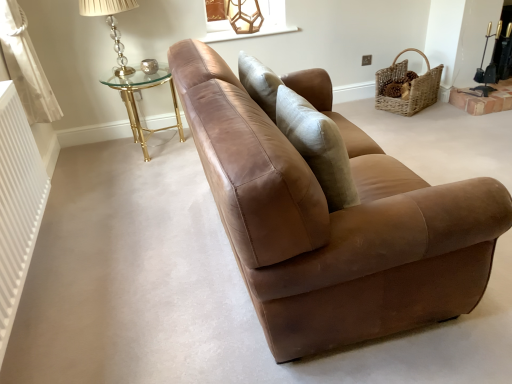
What do you see at coordinates (17, 204) in the screenshot? I see `white ribbed radiator at left` at bounding box center [17, 204].

Identify the location of brown leather couch at center. (333, 220).

What is the approximate height of white fabric curtain at left?

white fabric curtain at left is 30.56 inches in height.

The image size is (512, 384). Find the location of `white ribbed radiator at left`. white ribbed radiator at left is located at coordinates (17, 204).

Would you say white ribbed radiator at left is inside or outside metallic glass table lamp at upper center, which is the first table lamp in right-to-left order?

white ribbed radiator at left is outside metallic glass table lamp at upper center, which is the first table lamp in right-to-left order.

Where is `radiator lying in front of the metallic glass table lamp at upper center, the second table lamp positioned from the front`? Image resolution: width=512 pixels, height=384 pixels. radiator lying in front of the metallic glass table lamp at upper center, the second table lamp positioned from the front is located at coordinates (17, 204).

From the image's perspective, which one is positioned lower, white ribbed radiator at left or metallic glass table lamp at upper center, which appears as the first table lamp when viewed from the back?

white ribbed radiator at left is shown below in the image.

Between point (30, 183) and point (248, 5), which one is positioned behind?

The point (248, 5) is more distant.

Which point is more forward, (323, 326) or (139, 79)?

The point (323, 326) is closer.

Can gold metallic glass table at upper left be found inside brown leather couch at center?

No.

Is brown leather couch at center facing away from gold metallic glass table at upper left?

No, brown leather couch at center's orientation is not away from gold metallic glass table at upper left.

Does brown leather couch at center appear on the left side of gold metallic glass table at upper left?

No, brown leather couch at center is not to the left of gold metallic glass table at upper left.

At what (x,y) coordinates should I click in order to perform the action: click on the 1st table lamp located above the white ribbed radiator at left (from a real-world perspective). Please return your answer as a coordinate pair (x, y). Looking at the image, I should click on (244, 15).

From a real-world perspective, who is located lower, metallic glass table lamp at upper center, which is the first table lamp in right-to-left order, or white ribbed radiator at left?

white ribbed radiator at left is physically lower.

Between metallic glass table lamp at upper center, which is the first table lamp in right-to-left order, and white ribbed radiator at left, which one appears on the right side from the viewer's perspective?

Positioned to the right is metallic glass table lamp at upper center, which is the first table lamp in right-to-left order.

Are metallic glass table lamp at upper center, which is the first table lamp in right-to-left order, and white ribbed radiator at left far apart?

Absolutely, metallic glass table lamp at upper center, which is the first table lamp in right-to-left order, is distant from white ribbed radiator at left.

Does point (395, 102) appear closer or farther from the camera than point (134, 138)?

Point (395, 102) appears to be farther away from the viewer than point (134, 138).

Looking at their sizes, would you say woven natural basket at upper right is wider or thinner than gold metallic glass table at upper left?

Considering their sizes, woven natural basket at upper right looks slimmer than gold metallic glass table at upper left.

Does woven natural basket at upper right have a larger size compared to gold metallic glass table at upper left?

No.

Is woven natural basket at upper right taller than gold metallic glass table at upper left?

No, woven natural basket at upper right is not taller than gold metallic glass table at upper left.

Could you tell me if metallic glass table lamp at upper center, the second table lamp positioned from the front, is turned towards translucent glass lampshade at upper left, the second table lamp when ordered from back to front?

No, metallic glass table lamp at upper center, the second table lamp positioned from the front, is not facing towards translucent glass lampshade at upper left, the second table lamp when ordered from back to front.

Does point (244, 32) appear closer or farther from the camera than point (120, 57)?

Point (244, 32).

Could you measure the distance between metallic glass table lamp at upper center, the 2th table lamp viewed from the left, and translucent glass lampshade at upper left, positioned as the first table lamp in left-to-right order?

metallic glass table lamp at upper center, the 2th table lamp viewed from the left, is 88.33 centimeters from translucent glass lampshade at upper left, positioned as the first table lamp in left-to-right order.

Which is more to the right, metallic glass table lamp at upper center, which is the first table lamp in right-to-left order, or translucent glass lampshade at upper left, positioned as the first table lamp in left-to-right order?

metallic glass table lamp at upper center, which is the first table lamp in right-to-left order.

Which object is wider, white ribbed radiator at left or brown leather couch at center?

With larger width is brown leather couch at center.

Is brown leather couch at center surrounded by white ribbed radiator at left?

No, brown leather couch at center is located outside of white ribbed radiator at left.

Is white ribbed radiator at left at the left side of brown leather couch at center?

Yes, white ribbed radiator at left is to the left of brown leather couch at center.

Is brown leather couch at center at the back of white ribbed radiator at left?

white ribbed radiator at left does not have its back to brown leather couch at center.

Could you tell me if gold metallic glass table at upper left is turned towards translucent glass lampshade at upper left, positioned as the first table lamp in left-to-right order?

No, gold metallic glass table at upper left is not turned towards translucent glass lampshade at upper left, positioned as the first table lamp in left-to-right order.

Is gold metallic glass table at upper left at the right side of translucent glass lampshade at upper left, positioned as the first table lamp in left-to-right order?

Yes.

From the image's perspective, is gold metallic glass table at upper left above or below translucent glass lampshade at upper left, positioned as the first table lamp in left-to-right order?

Clearly, from the image's perspective, gold metallic glass table at upper left is below translucent glass lampshade at upper left, positioned as the first table lamp in left-to-right order.

This screenshot has width=512, height=384. I want to click on the 2nd table lamp behind when counting from the white ribbed radiator at left, so click(x=244, y=15).

Image resolution: width=512 pixels, height=384 pixels. What are the coordinates of `table on the left of brown leather couch at center` in the screenshot? It's located at (135, 100).

Based on their spatial positions, is metallic glass table lamp at upper center, the second table lamp positioned from the front, or woven natural basket at upper right further from white fabric curtain at left?

The object further to white fabric curtain at left is woven natural basket at upper right.

Looking at the image, which one is located closer to brown leather couch at center, gold metallic glass table at upper left or metallic glass table lamp at upper center, the 2th table lamp viewed from the left?

The object closer to brown leather couch at center is gold metallic glass table at upper left.

Estimate the real-world distances between objects in this image. Which object is closer to white ribbed radiator at left, translucent glass lampshade at upper left, the second table lamp when ordered from back to front, or brown leather couch at center?

Among the two, brown leather couch at center is located nearer to white ribbed radiator at left.

Which object lies nearer to the anchor point gold metallic glass table at upper left, white ribbed radiator at left or brown leather couch at center?

Among the two, white ribbed radiator at left is located nearer to gold metallic glass table at upper left.

Which object lies nearer to the anchor point white fabric curtain at left, brown leather couch at center or white ribbed radiator at left?

white ribbed radiator at left lies closer to white fabric curtain at left than the other object.

Estimate the real-world distances between objects in this image. Which object is closer to white fabric curtain at left, woven natural basket at upper right or gold metallic glass table at upper left?

gold metallic glass table at upper left lies closer to white fabric curtain at left than the other object.

From the image, which object appears to be nearer to gold metallic glass table at upper left, translucent glass lampshade at upper left, the first table lamp positioned from the front, or white ribbed radiator at left?

translucent glass lampshade at upper left, the first table lamp positioned from the front, is positioned closer to the anchor gold metallic glass table at upper left.

Estimate the real-world distances between objects in this image. Which object is closer to white ribbed radiator at left, gold metallic glass table at upper left or woven natural basket at upper right?

gold metallic glass table at upper left lies closer to white ribbed radiator at left than the other object.

Locate an element on the screen. The image size is (512, 384). table situated between translucent glass lampshade at upper left, the first table lamp positioned from the front, and metallic glass table lamp at upper center, the 2th table lamp viewed from the left, from left to right is located at coordinates (135, 100).

Find the location of a particular element. table between white ribbed radiator at left and woven natural basket at upper right in the horizontal direction is located at coordinates (135, 100).

At what (x,y) coordinates should I click in order to perform the action: click on table lamp between white fabric curtain at left and metallic glass table lamp at upper center, which appears as the first table lamp when viewed from the back, from left to right. Please return your answer as a coordinate pair (x, y). Looking at the image, I should click on click(x=111, y=26).

At what (x,y) coordinates should I click in order to perform the action: click on table between brown leather couch at center and woven natural basket at upper right along the z-axis. Please return your answer as a coordinate pair (x, y). Image resolution: width=512 pixels, height=384 pixels. Looking at the image, I should click on (135, 100).